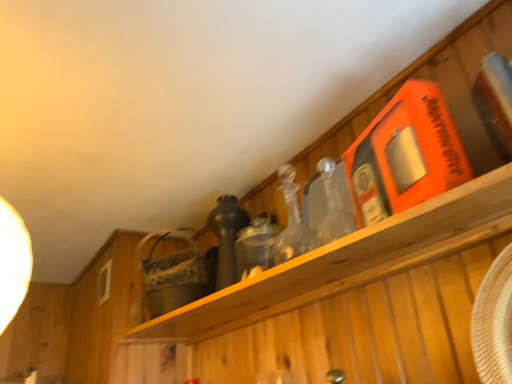
Question: From a real-world perspective, is woven straw basket at center above or below shiny dark glass bottle at center?

Choices:
 (A) above
 (B) below

Answer: (A)

Question: Is woven straw basket at center in front of or behind shiny dark glass bottle at center in the image?

Choices:
 (A) front
 (B) behind

Answer: (B)

Question: From the image's perspective, is woven straw basket at center positioned above or below shiny dark glass bottle at center?

Choices:
 (A) below
 (B) above

Answer: (A)

Question: From a real-world perspective, is shiny dark glass bottle at center above or below woven straw basket at center?

Choices:
 (A) above
 (B) below

Answer: (B)

Question: From the image's perspective, is shiny dark glass bottle at center located above or below woven straw basket at center?

Choices:
 (A) below
 (B) above

Answer: (B)

Question: Relative to woven straw basket at center, is shiny dark glass bottle at center in front or behind?

Choices:
 (A) front
 (B) behind

Answer: (A)

Question: Is shiny dark glass bottle at center inside or outside of woven straw basket at center?

Choices:
 (A) inside
 (B) outside

Answer: (B)